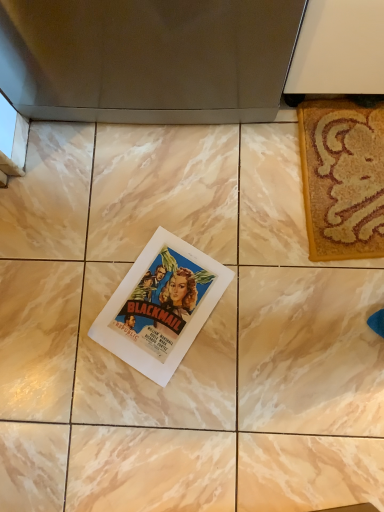
Find the location of a particular element. This screenshot has height=512, width=384. vacant area that is situated to the right of white paper at center is located at coordinates (267, 280).